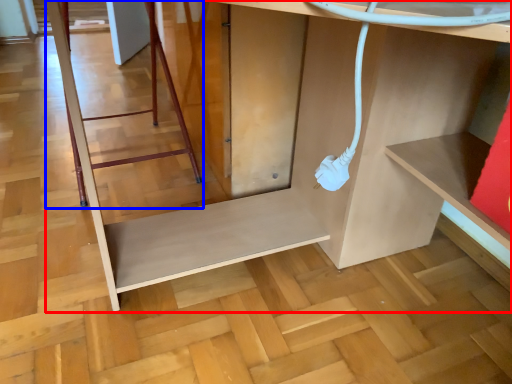
Question: Which object appears closest to the camera in this image, furniture (highlighted by a red box) or ladder (highlighted by a blue box)?

Choices:
 (A) furniture
 (B) ladder

Answer: (A)